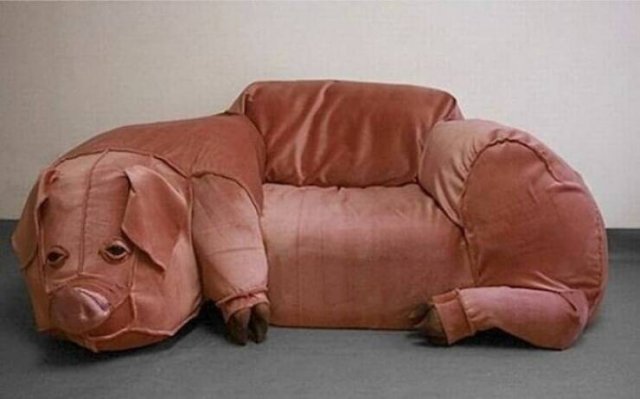
Locate an element on the screen. Image resolution: width=640 pixels, height=399 pixels. back of seat is located at coordinates (361, 144).